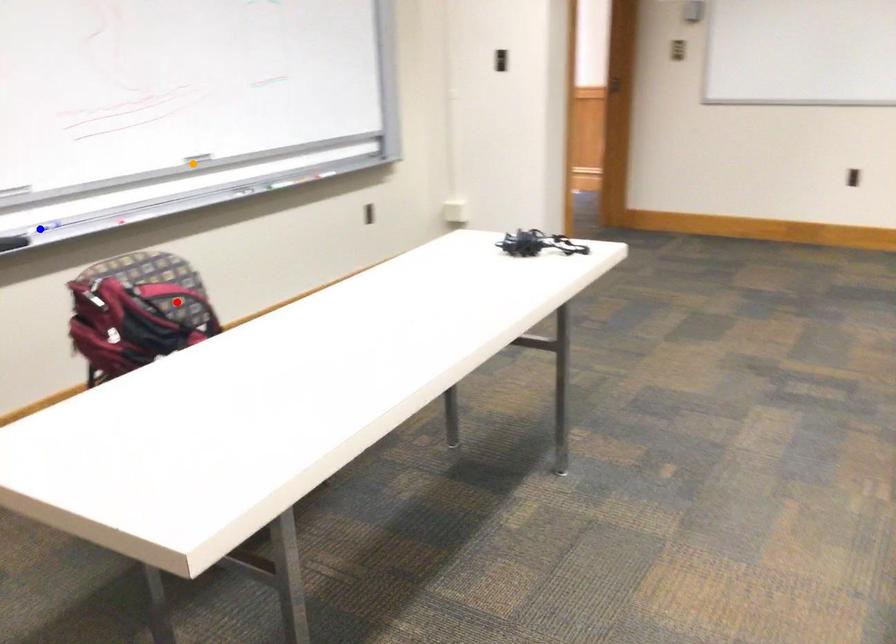
Order these from nearest to farthest:
blue point | orange point | red point

red point
blue point
orange point